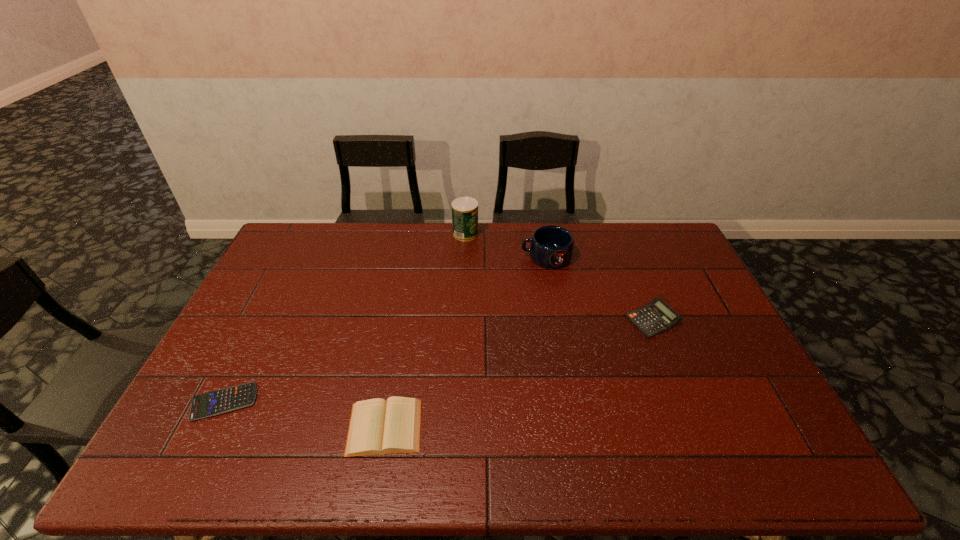
The image size is (960, 540). Find the location of `free location that satisfies the following two spatial constraints: 1. with the handle on the side of the second tallest object; 2. on the left side of the third nearest object`. free location that satisfies the following two spatial constraints: 1. with the handle on the side of the second tallest object; 2. on the left side of the third nearest object is located at coordinates (558, 320).

In order to click on vacant space that satisfies the following two spatial constraints: 1. on the back side of the right calculator; 2. with the handle on the side of the second tallest object in this screenshot , I will do (x=627, y=256).

In order to click on free location that satisfies the following two spatial constraints: 1. on the back side of the third farthest object; 2. with the handle on the side of the fourth shortest object in this screenshot , I will do `click(627, 256)`.

Locate an element on the screen. This screenshot has width=960, height=540. blank space that satisfies the following two spatial constraints: 1. on the back side of the third farthest object; 2. on the left side of the leftmost object is located at coordinates (265, 320).